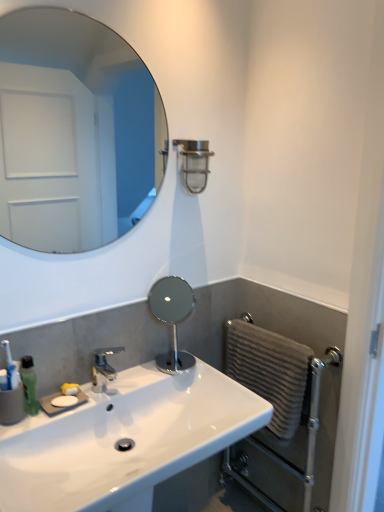
Question: Relative to gray textured towel at right, is green translucent soap dispenser at lower left in front or behind?

Choices:
 (A) behind
 (B) front

Answer: (B)

Question: From the image's perspective, relative to gray textured towel at right, is green translucent soap dispenser at lower left above or below?

Choices:
 (A) below
 (B) above

Answer: (B)

Question: Estimate the real-world distances between objects in this image. Which object is farther from the silver metallic faucet at center?

Choices:
 (A) polished silver mirror at center, positioned as the first mirror in bottom-to-top order
 (B) gray textured towel at right
 (C) satin nickel shower at upper center
 (D) white glossy mirror at upper left, arranged as the 1th mirror when viewed from the top
 (E) green translucent soap dispenser at lower left

Answer: (D)

Question: Estimate the real-world distances between objects in this image. Which object is farther from the white glossy mirror at upper left, marked as the second mirror in a bottom-to-top arrangement?

Choices:
 (A) satin nickel shower at upper center
 (B) white glossy sink at lower left
 (C) gray textured towel at right
 (D) green translucent soap dispenser at lower left
 (E) silver metallic faucet at center

Answer: (D)